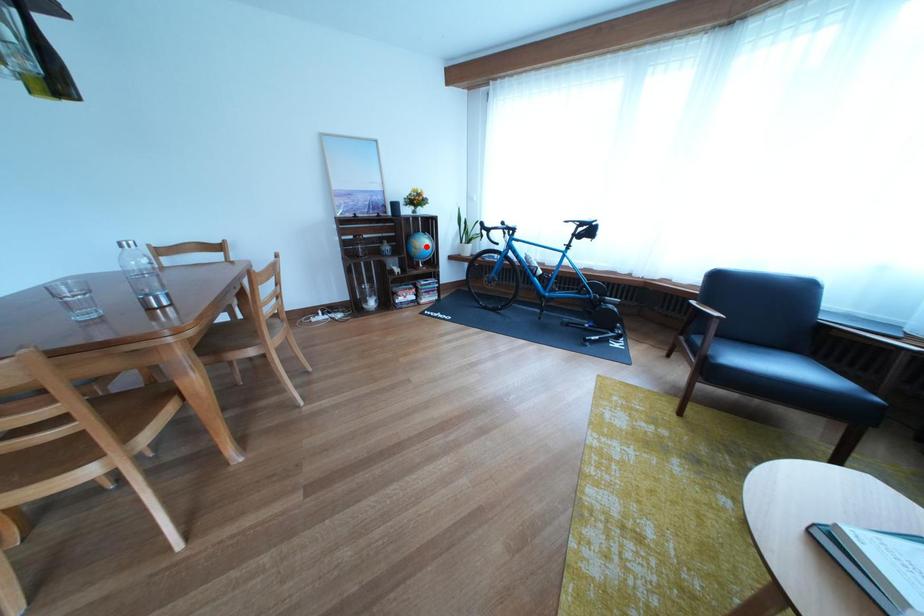
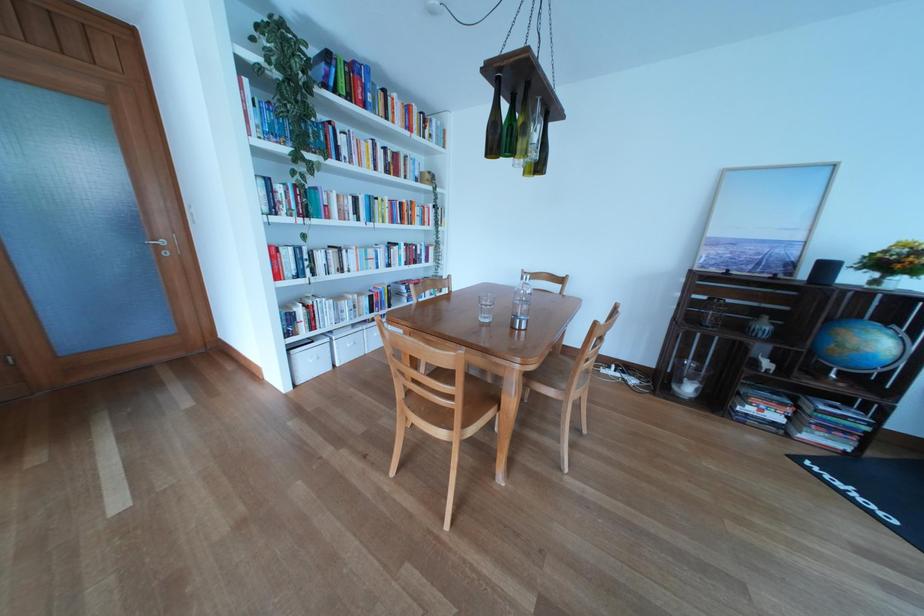
Question: I am providing you with two images of the same scene from different viewpoints. Given a red point in image1, look at the same physical point in image2. Is it:

Choices:
 (A) Closer to the viewpoint
 (B) Farther from the viewpoint

Answer: (B)